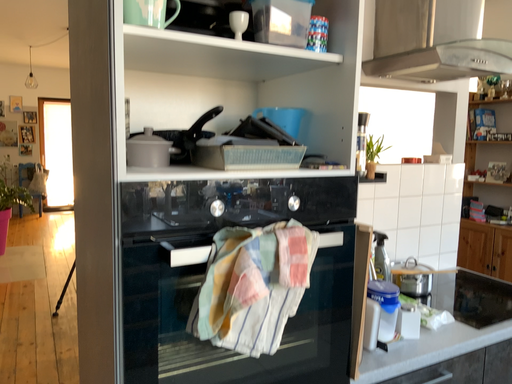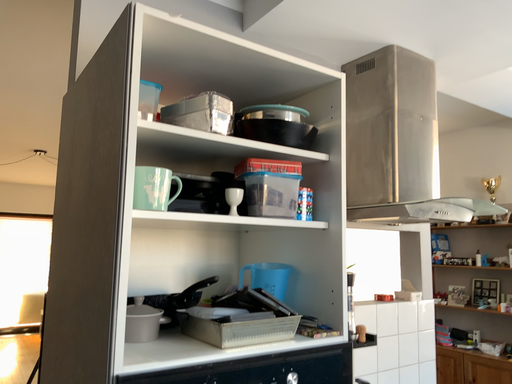
Question: How did the camera likely rotate when shooting the video?

Choices:
 (A) rotated upward
 (B) rotated downward

Answer: (A)